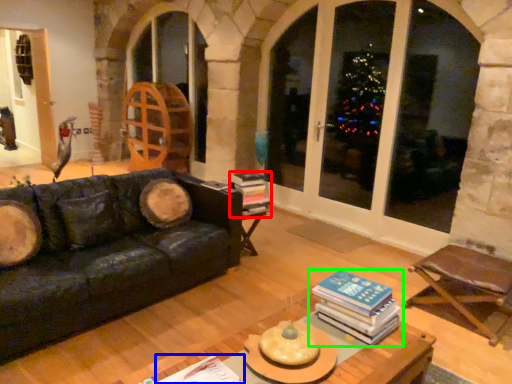
Question: Which object is the farthest from book (highlighted by a red box)? Choose among these: book (highlighted by a blue box) or book (highlighted by a green box).

Choices:
 (A) book
 (B) book

Answer: (A)